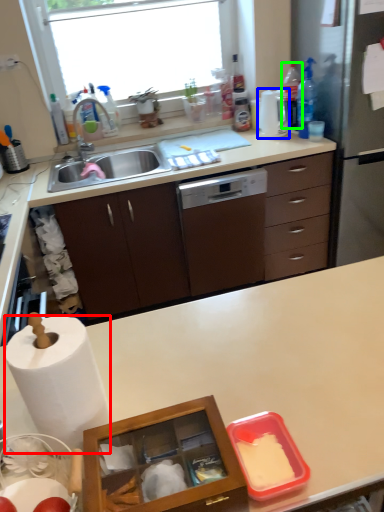
Question: Estimate the real-world distances between objects in this image. Which object is farther from paper towel (highlighted by a red box), kitchen appliance (highlighted by a blue box) or bottle (highlighted by a green box)?

Choices:
 (A) kitchen appliance
 (B) bottle

Answer: (B)